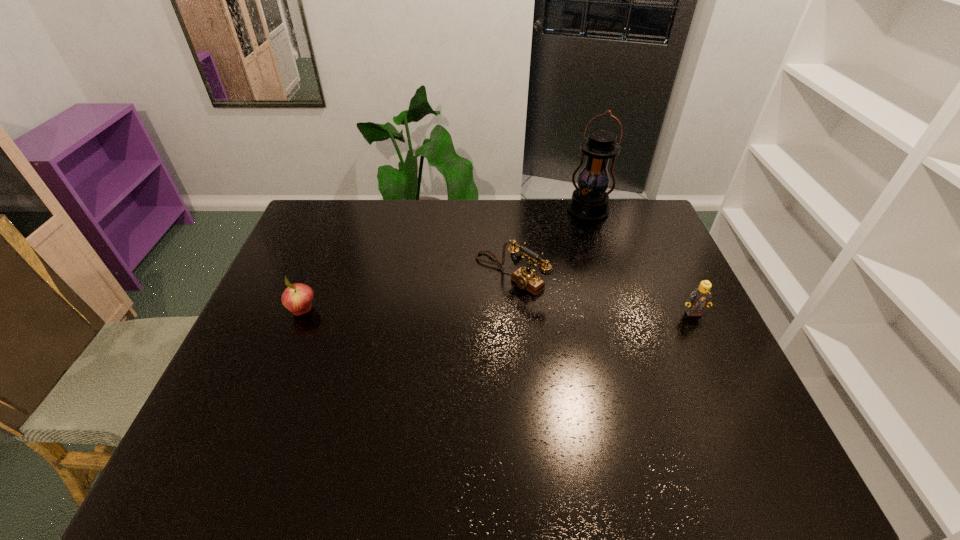
The width and height of the screenshot is (960, 540). In order to click on unoccupied position between the Lego and the second farthest object in this screenshot , I will do `click(602, 293)`.

Where is `blank region between the Lego and the third nearest object`? This screenshot has height=540, width=960. blank region between the Lego and the third nearest object is located at coordinates (602, 293).

This screenshot has height=540, width=960. Identify the location of unoccupied area between the second object from right to left and the rightmost object. (640, 262).

The image size is (960, 540). Find the location of `free area in between the Lego and the leftmost object`. free area in between the Lego and the leftmost object is located at coordinates (498, 312).

Identify which object is the nearest to the leftmost object. Please provide its 2D coordinates. Your answer should be formatted as a tuple, i.e. [(x, y)], where the tuple contains the x and y coordinates of a point satisfying the conditions above.

[(527, 279)]

Select which object is the third closest to the Lego. Please provide its 2D coordinates. Your answer should be formatted as a tuple, i.e. [(x, y)], where the tuple contains the x and y coordinates of a point satisfying the conditions above.

[(297, 298)]

Locate an element on the screen. The height and width of the screenshot is (540, 960). vacant space that satisfies the following two spatial constraints: 1. on the back side of the apple; 2. on the right side of the telephone is located at coordinates (318, 274).

Where is `free space that satisfies the following two spatial constraints: 1. on the back side of the telephone; 2. on the right side of the farthest object`? The height and width of the screenshot is (540, 960). free space that satisfies the following two spatial constraints: 1. on the back side of the telephone; 2. on the right side of the farthest object is located at coordinates (506, 211).